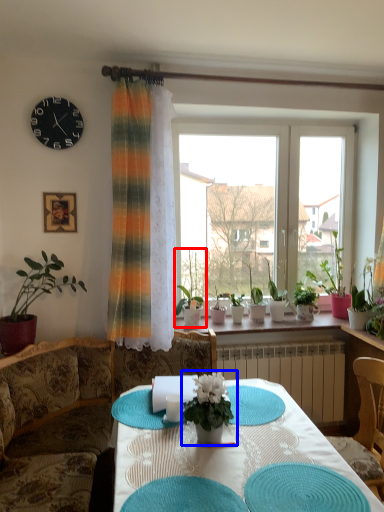
Question: Which object is closer to the camera taking this photo, houseplant (highlighted by a red box) or houseplant (highlighted by a blue box)?

Choices:
 (A) houseplant
 (B) houseplant

Answer: (B)